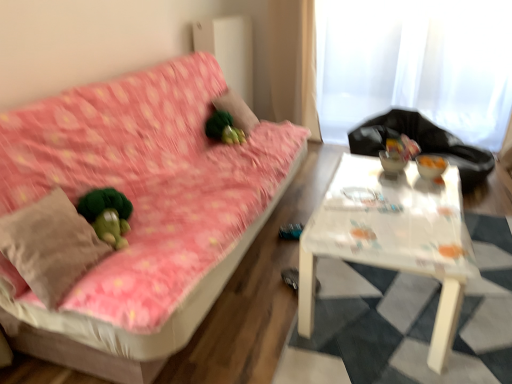
Locate an element on the screen. The image size is (512, 384). beige cotton throw pillow at left is located at coordinates (50, 246).

Locate an element on the screen. This screenshot has width=512, height=384. pink floral fabric couch at left is located at coordinates (142, 202).

At what (x,y) coordinates should I click in order to perform the action: click on green fuzzy ball at center. Please return your answer as a coordinate pair (x, y). Looking at the image, I should click on (223, 128).

In order to face black plastic bag at upper right, should I rotate leftwards or rightwards?

It's best to rotate right around 21.673 degrees.

In order to click on beige cotton throw pillow at left in this screenshot , I will do [50, 246].

Is beige cotton throw pillow at left facing away from white plastic table at center?

No.

Considering the relative sizes of beige cotton throw pillow at left and white plastic table at center in the image provided, is beige cotton throw pillow at left taller than white plastic table at center?

Incorrect, the height of beige cotton throw pillow at left is not larger of that of white plastic table at center.

Is beige cotton throw pillow at left to the left or to the right of white plastic table at center in the image?

Clearly, beige cotton throw pillow at left is on the left of white plastic table at center in the image.

Between point (365, 137) and point (242, 141), which one is positioned in front?

The point (242, 141) is closer to the camera.

Is black plastic bag at upper right placed right next to green fuzzy ball at center?

No.

Considering the positions of objects black plastic bag at upper right and green fuzzy ball at center in the image provided, who is more to the right, black plastic bag at upper right or green fuzzy ball at center?

black plastic bag at upper right is more to the right.

Is white plastic table at center closer to camera compared to green fuzzy pillow at upper center?

Yes, the depth of white plastic table at center is less than that of green fuzzy pillow at upper center.

Is white plastic table at center far away from green fuzzy pillow at upper center?

white plastic table at center is far away from green fuzzy pillow at upper center.

Do you think white plastic table at center is within green fuzzy pillow at upper center, or outside of it?

white plastic table at center lies outside green fuzzy pillow at upper center.

Is white plastic table at center facing away from green fuzzy pillow at upper center?

No.

From the picture: Considering the relative sizes of white sheer curtain at upper right and white plastic table at center in the image provided, is white sheer curtain at upper right bigger than white plastic table at center?

Yes, white sheer curtain at upper right is bigger than white plastic table at center.

At what (x,y) coordinates should I click in order to perform the action: click on curtain above the white plastic table at center (from a real-world perspective). Please return your answer as a coordinate pair (x, y). Looking at the image, I should click on (416, 64).

How much distance is there between white sheer curtain at upper right and white plastic table at center?

5.86 feet.

From a real-world perspective, is white sheer curtain at upper right above or below white plastic table at center?

white sheer curtain at upper right is above white plastic table at center.

Looking at this image, in terms of height, does pink floral fabric couch at left look taller or shorter compared to white plastic table at center?

Considering their sizes, pink floral fabric couch at left has more height than white plastic table at center.

Considering the relative sizes of pink floral fabric couch at left and white plastic table at center in the image provided, is pink floral fabric couch at left wider than white plastic table at center?

Incorrect, the width of pink floral fabric couch at left does not surpass that of white plastic table at center.

Does pink floral fabric couch at left have a smaller size compared to white plastic table at center?

Actually, pink floral fabric couch at left might be larger than white plastic table at center.

Is beige cotton throw pillow at left to the right of pink floral fabric couch at left from the viewer's perspective?

In fact, beige cotton throw pillow at left is to the left of pink floral fabric couch at left.

Is beige cotton throw pillow at left facing away from pink floral fabric couch at left?

Yes, beige cotton throw pillow at left is facing away from pink floral fabric couch at left.

From a real-world perspective, which is physically above, beige cotton throw pillow at left or pink floral fabric couch at left?

In real-world perspective, beige cotton throw pillow at left is above.

Between point (83, 248) and point (210, 171), which one is positioned behind?

Point (210, 171)

Could you tell me if white sheer curtain at upper right is turned towards black plastic bag at upper right?

Yes, white sheer curtain at upper right is aimed at black plastic bag at upper right.

Based on the photo, visually, is white sheer curtain at upper right positioned to the left or to the right of black plastic bag at upper right?

white sheer curtain at upper right is to the right of black plastic bag at upper right.

Is white sheer curtain at upper right bigger than black plastic bag at upper right?

No, white sheer curtain at upper right is not bigger than black plastic bag at upper right.

How many degrees apart are the facing directions of white sheer curtain at upper right and black plastic bag at upper right?

The angle between the facing direction of white sheer curtain at upper right and the facing direction of black plastic bag at upper right is 89.5 degrees.

The width and height of the screenshot is (512, 384). What are the coordinates of `table that is below the beige cotton throw pillow at left (from the image's perspective)` in the screenshot? It's located at (392, 237).

Find the location of a particular element. The height and width of the screenshot is (384, 512). sit that appears on the right of green fuzzy ball at center is located at coordinates (423, 143).

From the picture: When comparing their distances from white plastic table at center, does green fuzzy ball at center or green fuzzy pillow at upper center seem closer?

Based on the image, green fuzzy ball at center appears to be nearer to white plastic table at center.

Which object lies nearer to the anchor point green fuzzy ball at center, pink floral fabric couch at left or white plastic table at center?

pink floral fabric couch at left is positioned closer to the anchor green fuzzy ball at center.

Estimate the real-world distances between objects in this image. Which object is further from green fuzzy pillow at upper center, white plastic table at center or white sheer curtain at upper right?

The object further to green fuzzy pillow at upper center is white sheer curtain at upper right.

When comparing their distances from white plastic table at center, does green fuzzy ball at center or white sheer curtain at upper right seem further?

white sheer curtain at upper right.

Which object lies nearer to the anchor point black plastic bag at upper right, white sheer curtain at upper right or white plastic table at center?

Based on the image, white sheer curtain at upper right appears to be nearer to black plastic bag at upper right.

Considering their positions, is black plastic bag at upper right positioned closer to green fuzzy pillow at upper center than pink floral fabric couch at left?

The object closer to green fuzzy pillow at upper center is pink floral fabric couch at left.

Considering their positions, is green fuzzy pillow at upper center positioned closer to pink floral fabric couch at left than black plastic bag at upper right?

The object closer to pink floral fabric couch at left is green fuzzy pillow at upper center.

Estimate the real-world distances between objects in this image. Which object is further from white sheer curtain at upper right, green fuzzy ball at center or beige cotton throw pillow at left?

Among the two, beige cotton throw pillow at left is located further to white sheer curtain at upper right.

Find the location of a particular element. table located between green fuzzy ball at center and white sheer curtain at upper right in the left-right direction is located at coordinates (392, 237).

Locate an element on the screen. This screenshot has width=512, height=384. sit between white plastic table at center and white sheer curtain at upper right along the z-axis is located at coordinates (423, 143).

Where is `sit located between pink floral fabric couch at left and green fuzzy pillow at upper center in the depth direction`? sit located between pink floral fabric couch at left and green fuzzy pillow at upper center in the depth direction is located at coordinates (x=423, y=143).

Where is `toy between beige cotton throw pillow at left and white sheer curtain at upper right`? This screenshot has height=384, width=512. toy between beige cotton throw pillow at left and white sheer curtain at upper right is located at coordinates (x=223, y=128).